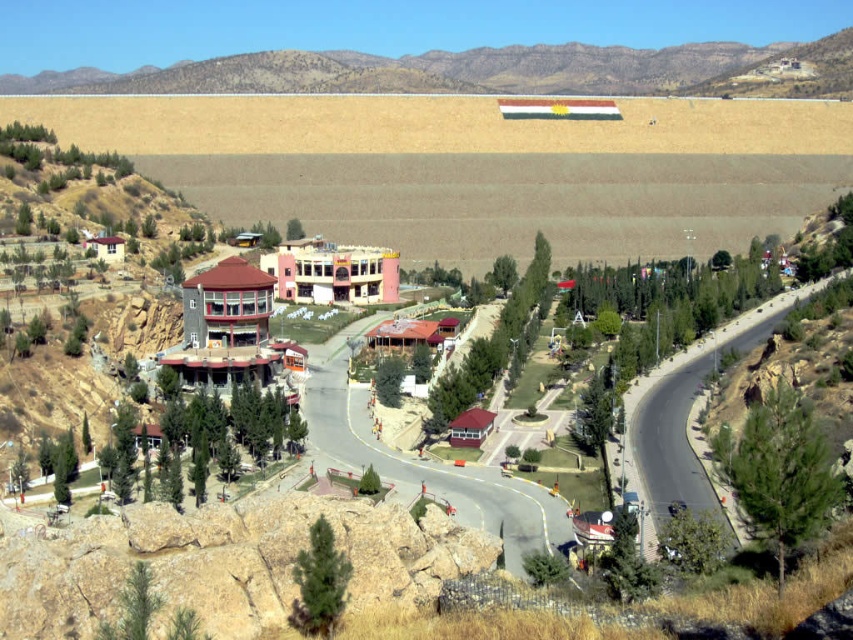
You are standing at the dam wall and want to reach the point marked as point (682, 413). There is an obstacle at point (90, 76). Can you go around it?

Point (90, 76) is closer to you than point (682, 413), so you must go around the obstacle at point (90, 76) before reaching point (682, 413).

In the scene shown: What are the coordinates of the brown rocky mountain at upper center?

The brown rocky mountain at upper center is located at coordinates point (482, 72).